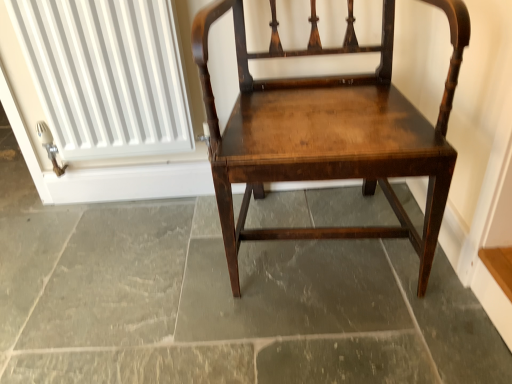
Question: From the image's perspective, is dark gray stone floor at center above or below white ribbed radiator at upper left?

Choices:
 (A) below
 (B) above

Answer: (A)

Question: Do you think dark gray stone floor at center is within white ribbed radiator at upper left, or outside of it?

Choices:
 (A) outside
 (B) inside

Answer: (A)

Question: Which is nearer to the white ribbed radiator at upper left?

Choices:
 (A) dark gray stone floor at center
 (B) shiny dark wood chair at center

Answer: (B)

Question: Which is nearer to the white ribbed radiator at upper left?

Choices:
 (A) shiny dark wood chair at center
 (B) dark gray stone floor at center

Answer: (A)